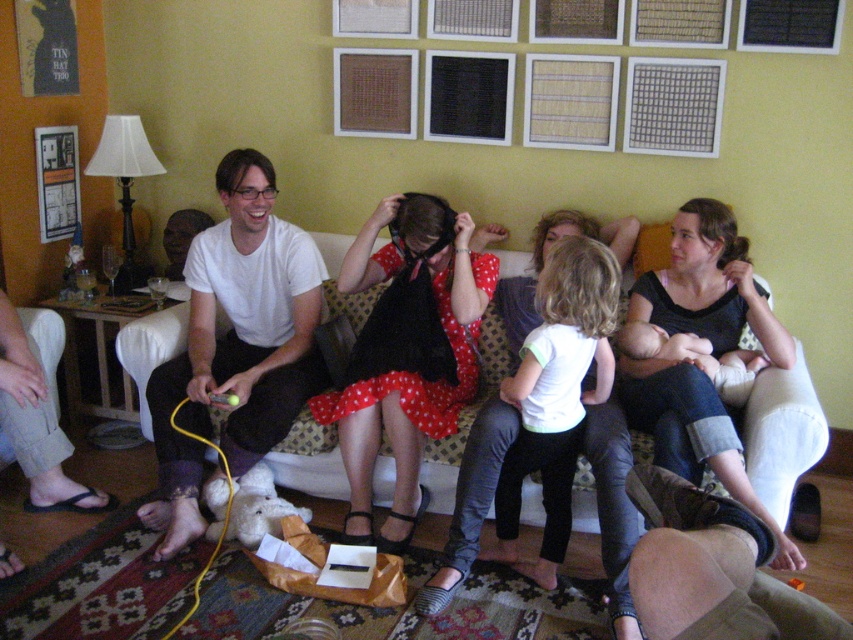
Question: Which of the following is the farthest from the observer?

Choices:
 (A) (550, 406)
 (B) (310, 333)

Answer: (B)

Question: From the image, what is the correct spatial relationship of white matte shirt at left in relation to white matte shirt at center?

Choices:
 (A) below
 (B) above

Answer: (B)

Question: Estimate the real-world distances between objects in this image. Which object is closer to the white matte shirt at center?

Choices:
 (A) brown leather couch at lower right
 (B) polka dot dress at center

Answer: (B)

Question: Is white matte shirt at center closer to the viewer compared to patterned fabric couch at center?

Choices:
 (A) no
 (B) yes

Answer: (B)

Question: Which object is positioned closest to the brown leather couch at lower right?

Choices:
 (A) white matte shirt at center
 (B) white matte shirt at left
 (C) patterned fabric couch at center

Answer: (A)

Question: Does dark gray knit sweater at center come in front of white matte shirt at center?

Choices:
 (A) yes
 (B) no

Answer: (A)